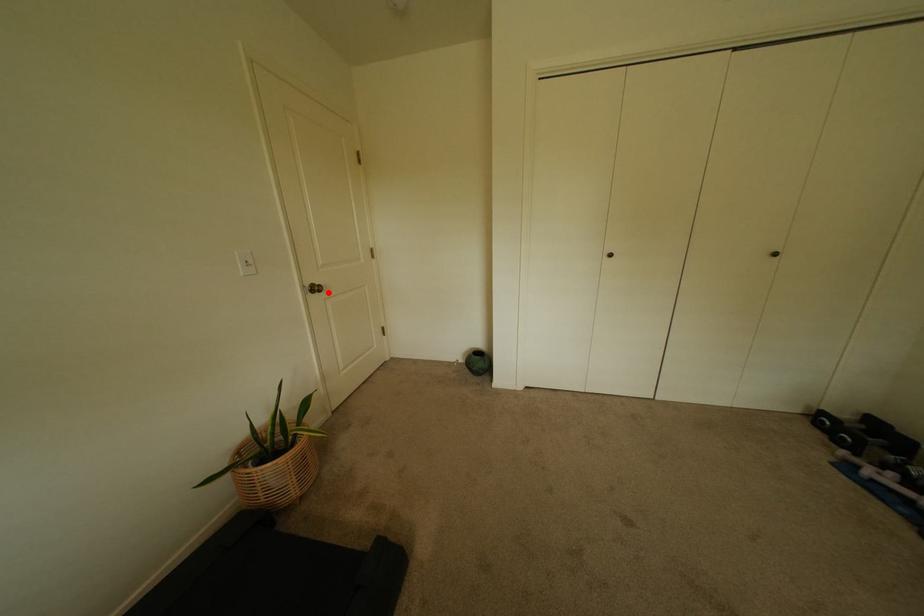
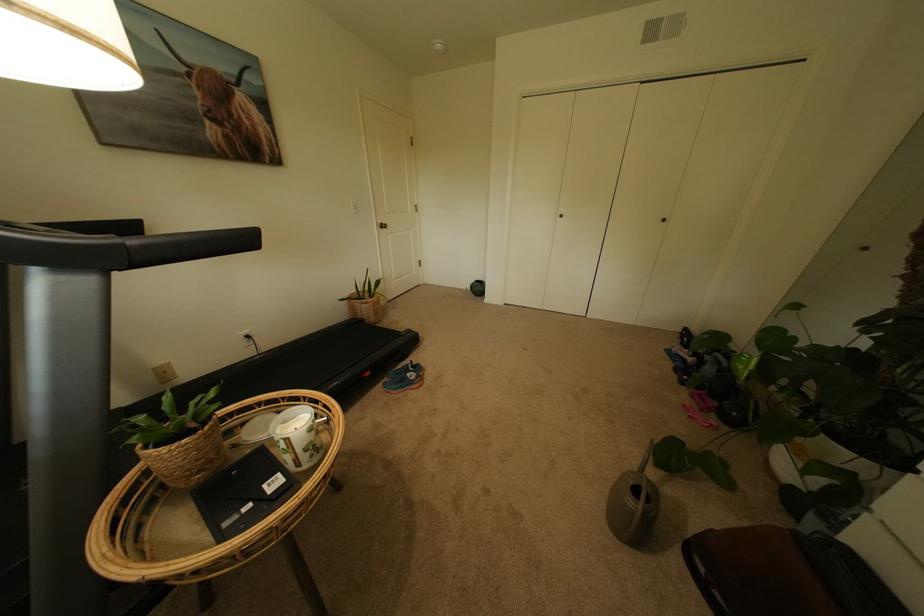
The point at the highlighted location is marked in the first image. Where is the corresponding point in the second image?

(394, 229)